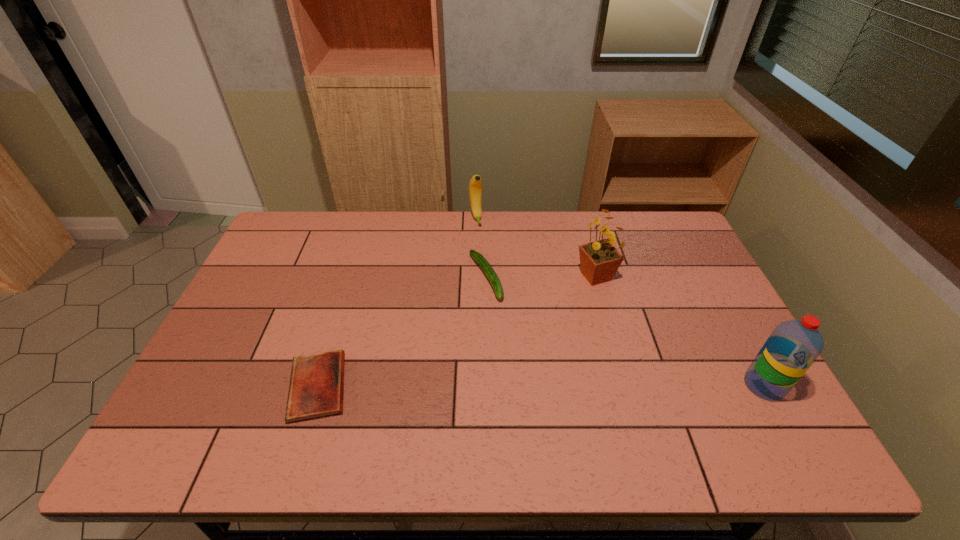
Find the location of a particular element. The width and height of the screenshot is (960, 540). the shortest object is located at coordinates (316, 387).

The height and width of the screenshot is (540, 960). I want to click on diary, so click(316, 387).

Locate an element on the screen. water bottle is located at coordinates (794, 345).

Locate an element on the screen. sunflower is located at coordinates (599, 260).

The height and width of the screenshot is (540, 960). Find the location of `zucchini`. zucchini is located at coordinates (489, 272).

Find the location of a particular element. banana is located at coordinates (475, 186).

You are a GUI agent. You are given a task and a screenshot of the screen. Output one action in this format:
    pyautogui.click(x=<x>, y=<y>)
    Task: Click on the farthest object
    The width and height of the screenshot is (960, 540).
    Given the screenshot: What is the action you would take?
    pyautogui.click(x=475, y=186)

This screenshot has width=960, height=540. Find the location of `vacant area situated 0.130m on the left of the shortest object`. vacant area situated 0.130m on the left of the shortest object is located at coordinates (233, 387).

This screenshot has height=540, width=960. Find the location of `vacant position located at the front of the second object from right to left with flowers visible`. vacant position located at the front of the second object from right to left with flowers visible is located at coordinates (572, 335).

I want to click on free space located 0.200m at the front of the second object from right to left with flowers visible, so click(572, 335).